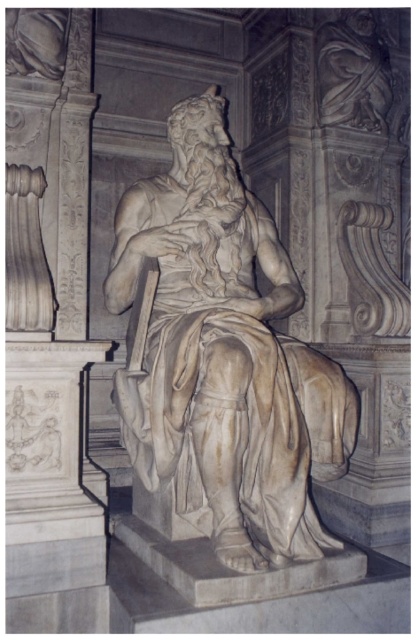
You are an art conservator working on a restoration project. You need to place a protective barrier between the white marble statue at center and the marble carving at upper center. What is the minimum width the barrier should be to fit between them?

The white marble statue at center and the marble carving at upper center are 32.08 inches apart from each other. Therefore, the protective barrier should be at least 32.08 inches wide to fit between them.

You are an art student analyzing the composition of the sculpture. You notice two key elements, the white marble statue at center and the marble carving at upper center. Which of these elements is located to the left of the other?

The white marble statue at center is positioned on the left side of marble carving at upper center, so the white marble statue at center is to the left of the marble carving at upper center.

You are an art student trying to decide which sculpture to sketch first. You see the white marble statue at center and the marble carving at upper center. Which one should you choose if you want to draw a larger subject?

The white marble statue at center is bigger than the marble carving at upper center, so you should choose the white marble statue at center to draw first.